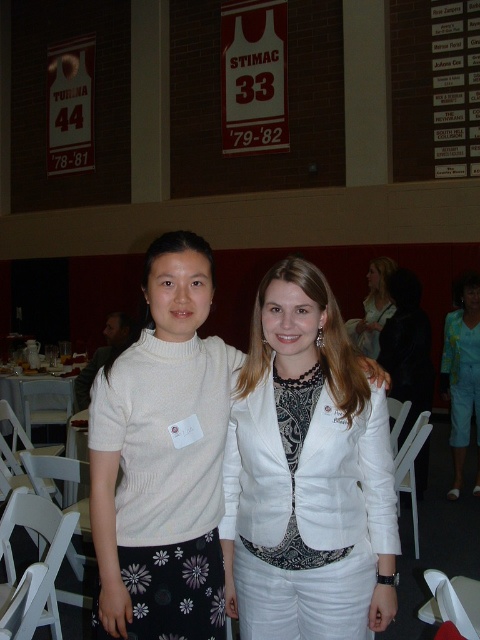
Between white leather blazer at center and white matte sweater at center, which one is positioned higher?

white matte sweater at center is above.

Which is behind, point (334, 529) or point (156, 547)?

Point (334, 529)

What do you see at coordinates (303, 470) in the screenshot? I see `white leather blazer at center` at bounding box center [303, 470].

Where is `white leather blazer at center`? white leather blazer at center is located at coordinates (303, 470).

Who is positioned more to the left, white matte sweater at center or light brown hair at upper right?

white matte sweater at center is more to the left.

Can you confirm if white matte sweater at center is bigger than light brown hair at upper right?

Actually, white matte sweater at center might be smaller than light brown hair at upper right.

Find the location of a particular element. The height and width of the screenshot is (640, 480). white matte sweater at center is located at coordinates (163, 458).

Where is `white matte sweater at center`? white matte sweater at center is located at coordinates (163, 458).

Between light blue fabric pants at lower right and light brown hair at upper right, which one has less height?

With less height is light brown hair at upper right.

Locate an element on the screen. This screenshot has width=480, height=640. light blue fabric pants at lower right is located at coordinates (463, 374).

This screenshot has width=480, height=640. Identify the location of light blue fabric pants at lower right. (463, 374).